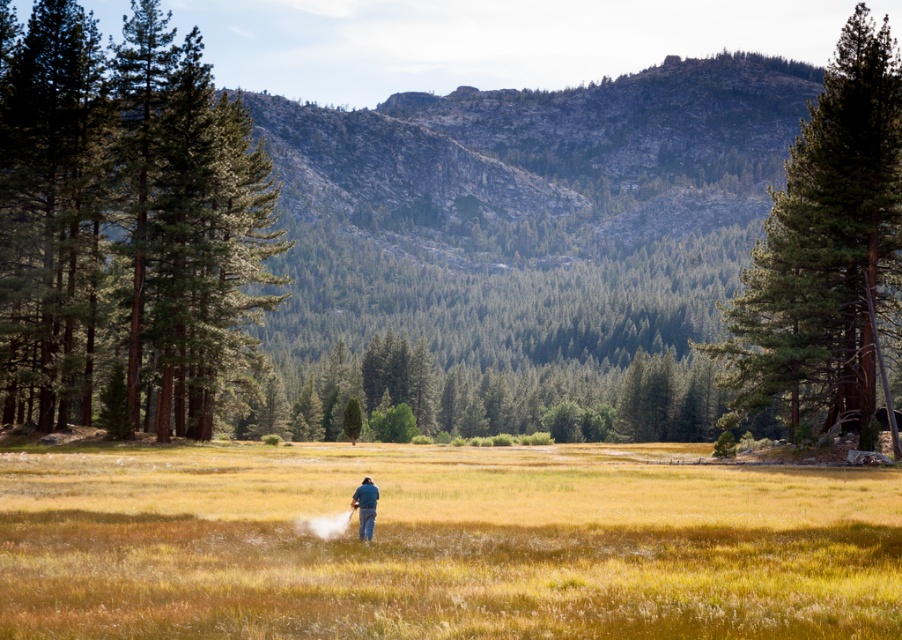
You are standing at the point marked as point (x=443, y=545) in the image. What is the color of the grass at your current location?

The yellow grass at center is located at point (x=443, y=545), so the color of the grass at your current location is yellow.

You are a hiker planning to cross the meadow from the green textured pine trees at left to the green textured tree at right. Given that your average walking speed is 1.5 meters per second, approximately how many seconds will it take you to reach the tree on the right?

The distance between the green textured pine trees at left and the green textured tree at right is 38.92 meters. At a walking speed of 1.5 meters per second, it would take approximately 25.95 seconds to cross the meadow. Rounded to the nearest whole number, this is about 26 seconds.

You are a hiker standing in the meadow and want to take a photo of the green textured tree at right and the blue denim jeans at center. Which object should you zoom in on first to ensure both are in focus?

The green textured tree at right is taller than the blue denim jeans at center, so you should zoom in on the green textured tree at right first to ensure both are in focus.